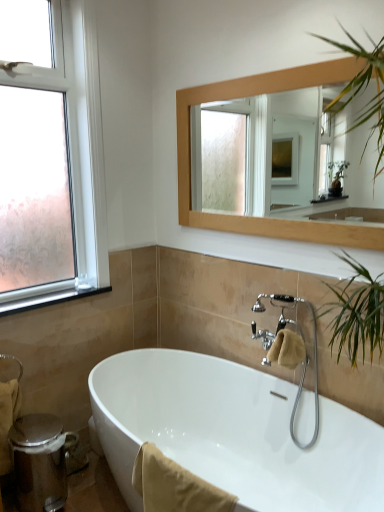
Question: Is clear glass window at upper left in contact with beige cotton towel at lower center, the 3th bath towel in the back-to-front sequence?

Choices:
 (A) yes
 (B) no

Answer: (B)

Question: Is clear glass window at upper left further to camera compared to beige cotton towel at lower center, acting as the 1th bath towel starting from the front?

Choices:
 (A) yes
 (B) no

Answer: (A)

Question: Can you confirm if clear glass window at upper left is positioned to the right of beige cotton towel at lower center, which is counted as the 2th bath towel, starting from the right?

Choices:
 (A) no
 (B) yes

Answer: (A)

Question: Is clear glass window at upper left not inside beige cotton towel at lower center, which is counted as the 2th bath towel, starting from the right?

Choices:
 (A) no
 (B) yes

Answer: (B)

Question: From the image's perspective, would you say clear glass window at upper left is shown under beige cotton towel at lower center, the 3th bath towel in the back-to-front sequence?

Choices:
 (A) no
 (B) yes

Answer: (A)

Question: Is wooden frame mirror at upper center spatially inside clear glass window at upper left, or outside of it?

Choices:
 (A) outside
 (B) inside

Answer: (A)

Question: Is wooden frame mirror at upper center in front of or behind clear glass window at upper left in the image?

Choices:
 (A) front
 (B) behind

Answer: (A)

Question: Is wooden frame mirror at upper center to the left or to the right of clear glass window at upper left in the image?

Choices:
 (A) right
 (B) left

Answer: (A)

Question: Looking at their shapes, would you say wooden frame mirror at upper center is wider or thinner than clear glass window at upper left?

Choices:
 (A) wide
 (B) thin

Answer: (B)

Question: From the image's perspective, is beige cotton towel at lower left, which ranks as the first bath towel in back-to-front order, positioned above or below wooden frame mirror at upper center?

Choices:
 (A) below
 (B) above

Answer: (A)

Question: Is beige cotton towel at lower left, which ranks as the first bath towel in back-to-front order, wider or thinner than wooden frame mirror at upper center?

Choices:
 (A) thin
 (B) wide

Answer: (B)

Question: Does point (13, 418) appear closer or farther from the camera than point (193, 122)?

Choices:
 (A) farther
 (B) closer

Answer: (B)

Question: Do you think beige cotton towel at lower left, the third bath towel when ordered from right to left, is within wooden frame mirror at upper center, or outside of it?

Choices:
 (A) outside
 (B) inside

Answer: (A)

Question: From the image's perspective, is beige cotton towel at lower center, the 3th bath towel in the back-to-front sequence, positioned above or below clear glass window at upper left?

Choices:
 (A) above
 (B) below

Answer: (B)

Question: In the image, is beige cotton towel at lower center, acting as the 1th bath towel starting from the front, on the left side or the right side of clear glass window at upper left?

Choices:
 (A) right
 (B) left

Answer: (A)